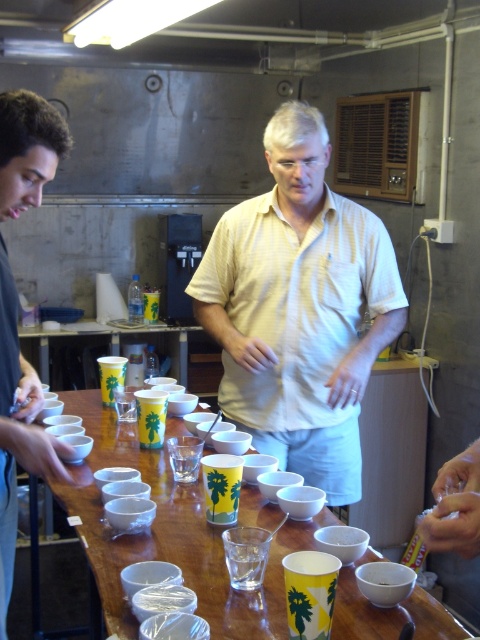
You are standing at the end of the table and want to hand a document to the person wearing the yellow striped shirt at center. Which direction should you walk to reach them first, considering their positions relative to the brown curly hair at left?

You should walk towards the right side of the brown curly hair at left to reach the yellow striped shirt at center first since it is positioned to the right of the brown curly hair at left.

You are planning to place a rectangular box that is 1 meter wide on the wooden table at center. Considering the yellow striped shirt at center is also on the table, will the box fit without overlapping the shirt?

The yellow striped shirt at center is narrower than the wooden table at center, but the description does not provide specific measurements for either the shirt or the table. Therefore, it is uncertain whether the 1 meter wide box will fit without overlapping the shirt.